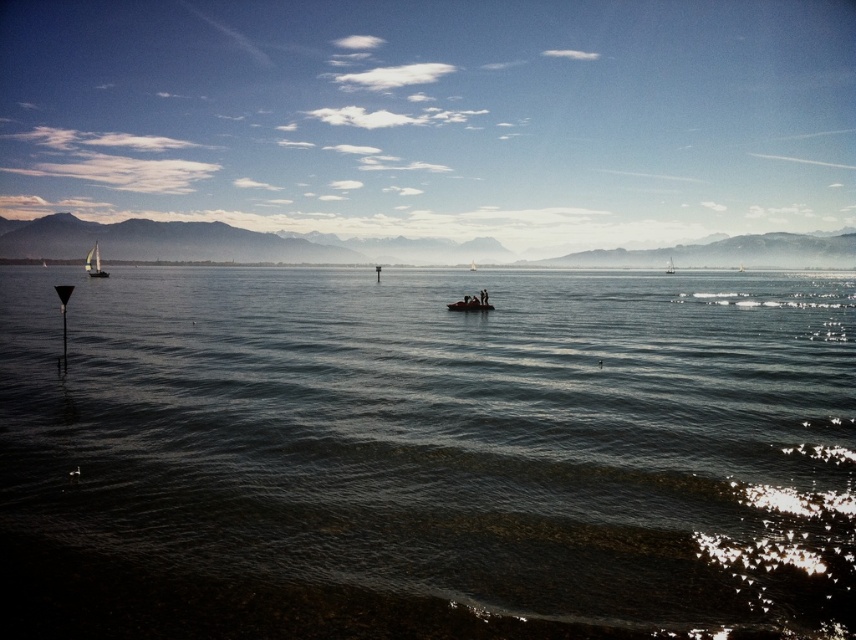
The height and width of the screenshot is (640, 856). I want to click on white sailboat at left, so click(x=94, y=262).

How distant is white sailboat at left from white sailboat at center?

235.83 meters

Find the location of a particular element. This screenshot has height=640, width=856. white sailboat at left is located at coordinates (94, 262).

You are a GUI agent. You are given a task and a screenshot of the screen. Output one action in this format:
    pyautogui.click(x=<x>, y=<y>)
    Task: Click on the white sailboat at left
    
    Given the screenshot: What is the action you would take?
    pyautogui.click(x=94, y=262)

Can you confirm if clear water at center is smaller than white sailboat at left?

Yes.

Does clear water at center have a lesser height compared to white sailboat at left?

Yes.

Between point (730, 337) and point (88, 266), which one is positioned behind?

Point (88, 266)

The height and width of the screenshot is (640, 856). I want to click on clear water at center, so tap(425, 456).

Between clear water at center and metallic silver raft at center, which one has less height?

metallic silver raft at center

Is point (617, 282) positioned after point (492, 307)?

Yes, it is.

The image size is (856, 640). In order to click on clear water at center in this screenshot , I will do `click(425, 456)`.

This screenshot has height=640, width=856. I want to click on clear water at center, so click(425, 456).